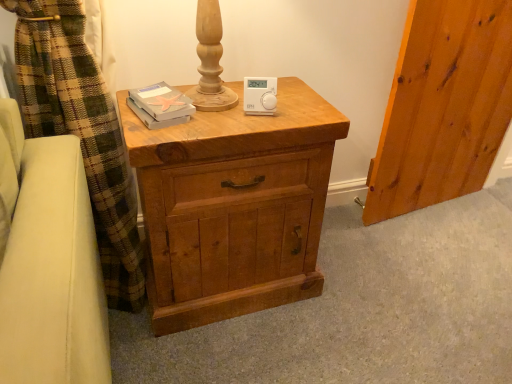
Question: From the image's perspective, is matte wood chest of drawers at center positioned above or below matte gray book at upper left?

Choices:
 (A) above
 (B) below

Answer: (B)

Question: Looking at their shapes, would you say matte wood chest of drawers at center is wider or thinner than matte gray book at upper left?

Choices:
 (A) thin
 (B) wide

Answer: (B)

Question: Which object is the farthest from the matte wood chest of drawers at center?

Choices:
 (A) white plastic thermostat at center
 (B) matte gray book at upper left

Answer: (A)

Question: Estimate the real-world distances between objects in this image. Which object is closer to the white plastic thermostat at center?

Choices:
 (A) matte wood chest of drawers at center
 (B) matte gray book at upper left

Answer: (B)